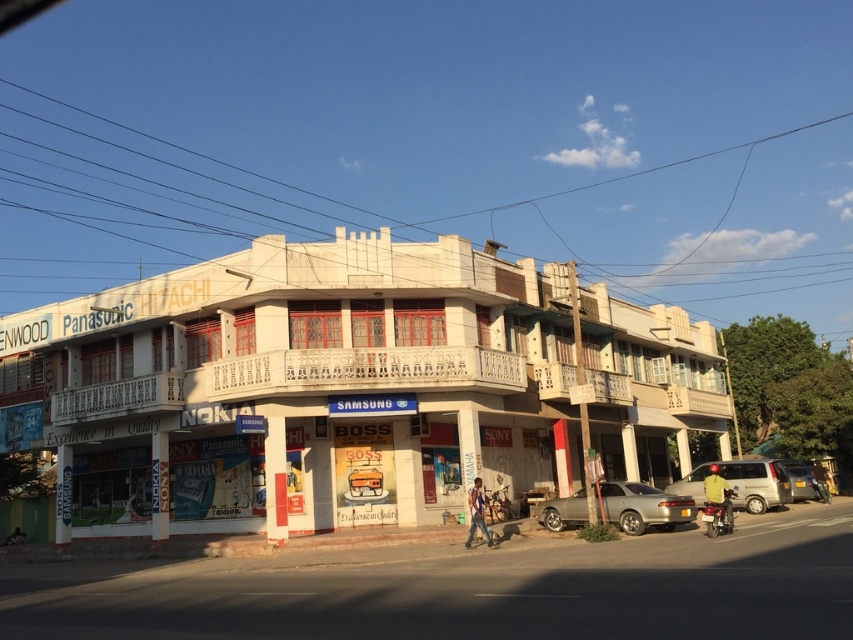
Question: Does satin silver sedan at center have a lesser width compared to silver metallic van at right?

Choices:
 (A) yes
 (B) no

Answer: (B)

Question: Estimate the real-world distances between objects in this image. Which object is farther from the white concrete building at center?

Choices:
 (A) silver metallic van at center
 (B) satin silver sedan at center
 (C) black wire at upper center

Answer: (C)

Question: Which point is closer to the camera?

Choices:
 (A) (816, 499)
 (B) (636, 529)

Answer: (B)

Question: Considering the relative positions of white concrete building at center and silver metallic van at right in the image provided, where is white concrete building at center located with respect to silver metallic van at right?

Choices:
 (A) left
 (B) right

Answer: (A)

Question: Does metallic silver motorcycle at lower right come in front of silver metallic van at right?

Choices:
 (A) no
 (B) yes

Answer: (B)

Question: Which point is closer to the camera taking this photo?

Choices:
 (A) (335, 474)
 (B) (583, 496)
 (C) (714, 506)
 (D) (779, 493)

Answer: (C)